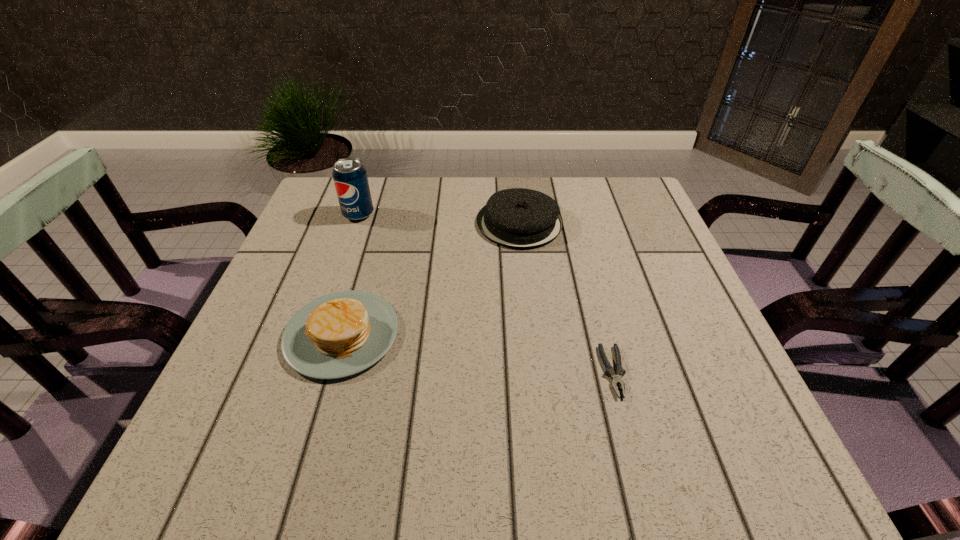
You are a GUI agent. You are given a task and a screenshot of the screen. Output one action in this format:
    pyautogui.click(x=<x>, y=<y>)
    Task: Click on the soda can that is positioned at the far edge
    Image resolution: width=960 pixels, height=540 pixels.
    Given the screenshot: What is the action you would take?
    pyautogui.click(x=350, y=178)

At what (x,y) coordinates should I click in order to perform the action: click on pancake that is at the far edge. Please return your answer as a coordinate pair (x, y). The height and width of the screenshot is (540, 960). Looking at the image, I should click on (518, 218).

The image size is (960, 540). I want to click on soda can that is at the left edge, so click(x=350, y=178).

I want to click on pancake located in the left edge section of the desktop, so click(340, 334).

At what (x,y) coordinates should I click in order to perform the action: click on object located at the far left corner. Please return your answer as a coordinate pair (x, y). The height and width of the screenshot is (540, 960). Looking at the image, I should click on (350, 178).

You are a GUI agent. You are given a task and a screenshot of the screen. Output one action in this format:
    pyautogui.click(x=<x>, y=<y>)
    Task: Click on the free location at the far edge
    Image resolution: width=960 pixels, height=540 pixels.
    Given the screenshot: What is the action you would take?
    pyautogui.click(x=412, y=177)

Locate an element on the screen. free spot at the near edge of the desktop is located at coordinates (597, 433).

Locate an element on the screen. free space at the left edge is located at coordinates (271, 396).

At what (x,y) coordinates should I click in order to perform the action: click on vacant space at the right edge. Please return your answer as a coordinate pair (x, y). This screenshot has height=540, width=960. Looking at the image, I should click on (632, 230).

Image resolution: width=960 pixels, height=540 pixels. What are the coordinates of `free location at the near left corner` in the screenshot? It's located at (210, 432).